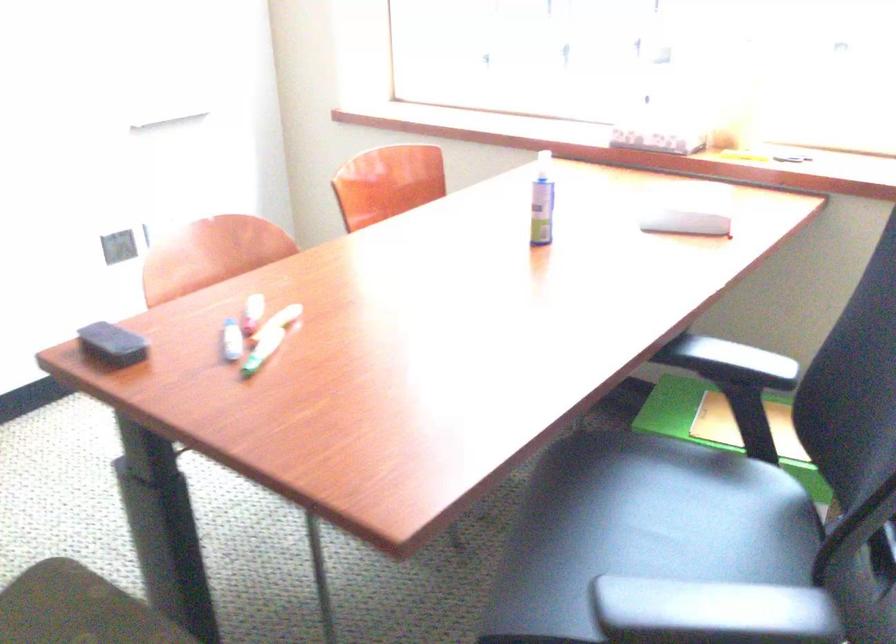
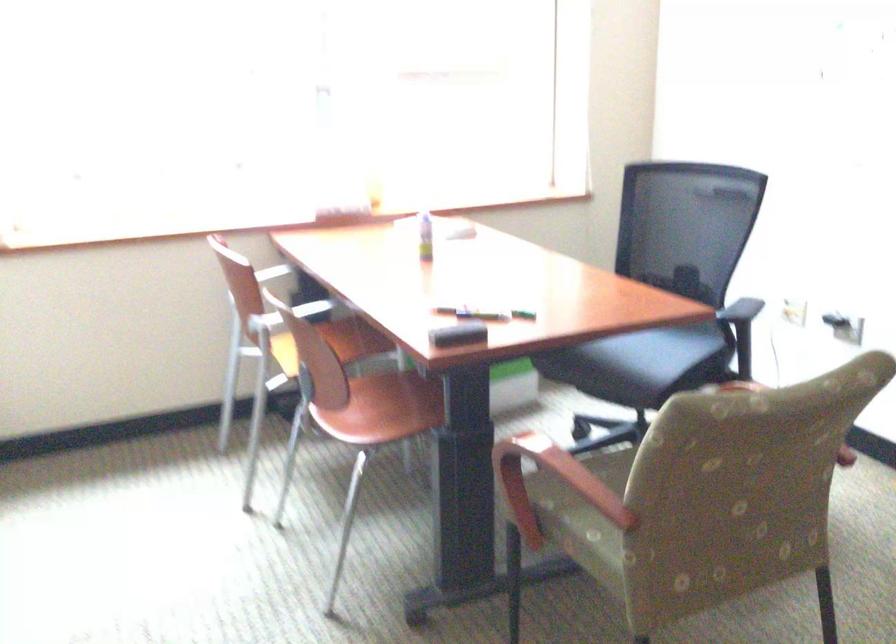
The point at (633, 158) is marked in the first image. Where is the corresponding point in the second image?

(346, 214)